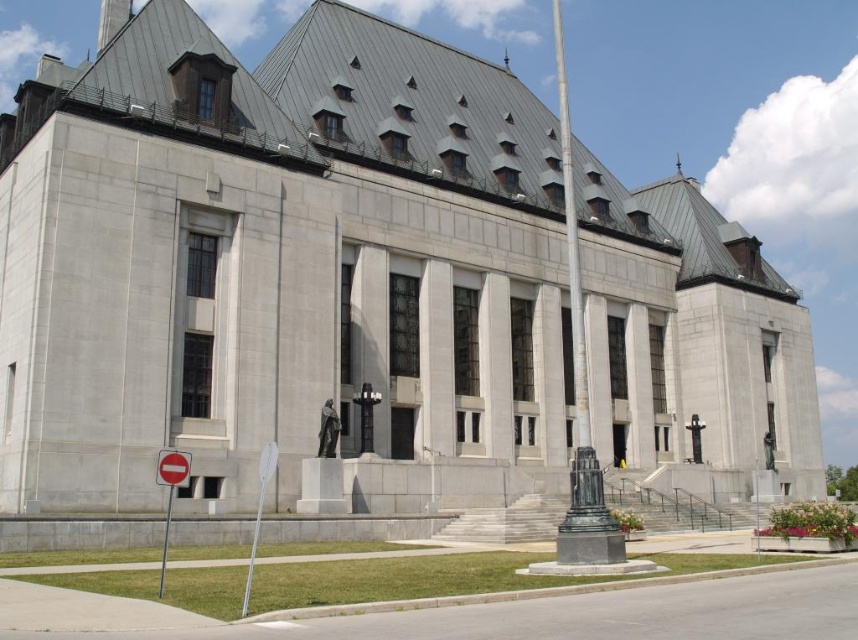
You are a visitor approaching the building and notice the bronze flagpole at center and the red plastic sign at lower left. Which object is taller?

The bronze flagpole at center is taller than the red plastic sign at lower left.

You are a visitor approaching the building and see the bronze flagpole at center and the red plastic sign at lower left. Which object is closer to the entrance of the building?

The bronze flagpole at center is closer to the entrance of the building because it is positioned above the red plastic sign at lower left, indicating it is in a more central and elevated position relative to the sign.

You are a visitor approaching the entrance of the building and see two signs at the lower left. Which sign is positioned more to the right between the metallic reflective sign at lower left and the red plastic sign at lower left?

The metallic reflective sign at lower left is positioned more to the right compared to the red plastic sign at lower left.